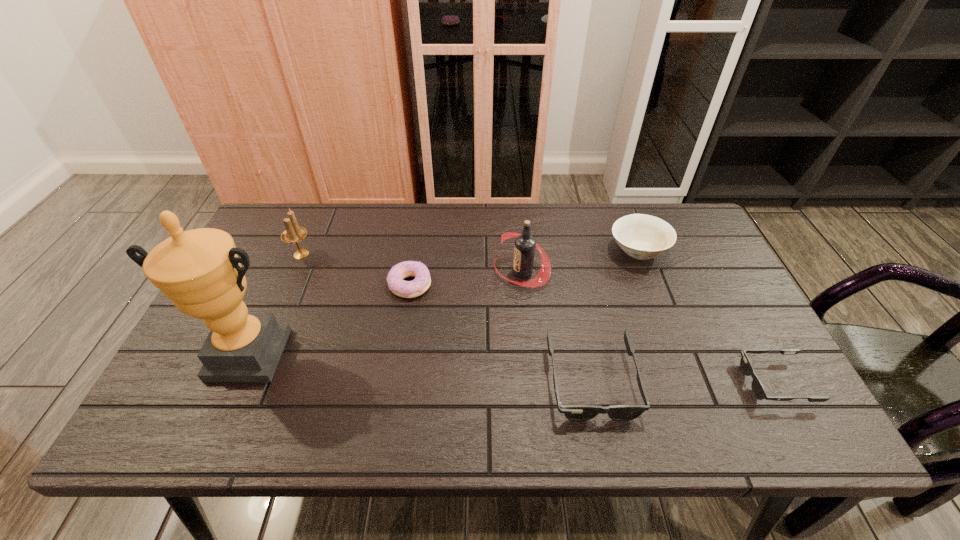
I want to click on candle holder present at the far edge, so click(293, 234).

Where is `bowl at the far edge`? bowl at the far edge is located at coordinates (641, 236).

Where is `award present at the near edge`? The width and height of the screenshot is (960, 540). award present at the near edge is located at coordinates (199, 270).

Where is `candle holder at the left edge`? This screenshot has height=540, width=960. candle holder at the left edge is located at coordinates (293, 234).

At what (x,y) coordinates should I click in order to perform the action: click on award present at the left edge. Please return your answer as a coordinate pair (x, y). Looking at the image, I should click on (199, 270).

Where is `sunglasses that is at the right edge`? This screenshot has height=540, width=960. sunglasses that is at the right edge is located at coordinates (758, 389).

Find the location of `bowl that is at the right edge`. bowl that is at the right edge is located at coordinates (641, 236).

Identify the location of object present at the far left corner. The image size is (960, 540). (293, 234).

The image size is (960, 540). Find the location of `object located in the near left corner section of the desktop`. object located in the near left corner section of the desktop is located at coordinates (199, 270).

Locate an element on the screen. Image resolution: width=960 pixels, height=540 pixels. object that is at the far right corner is located at coordinates (641, 236).